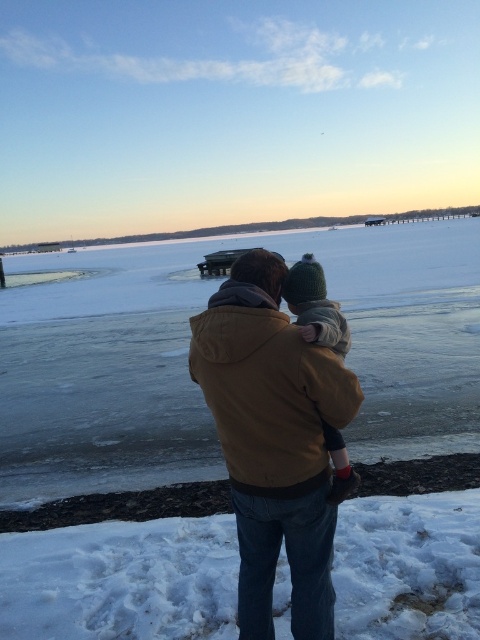
Question: Considering the relative positions of white fluffy snow at lower center and brown cotton jacket at center in the image provided, where is white fluffy snow at lower center located with respect to brown cotton jacket at center?

Choices:
 (A) right
 (B) left

Answer: (B)

Question: Does white fluffy snow at lower center have a lesser width compared to brown cotton jacket at center?

Choices:
 (A) yes
 (B) no

Answer: (B)

Question: Which point is farther to the camera?

Choices:
 (A) (384, 508)
 (B) (280, 336)

Answer: (A)

Question: Is white fluffy snow at lower center further to the viewer compared to brown cotton jacket at center?

Choices:
 (A) no
 (B) yes

Answer: (B)